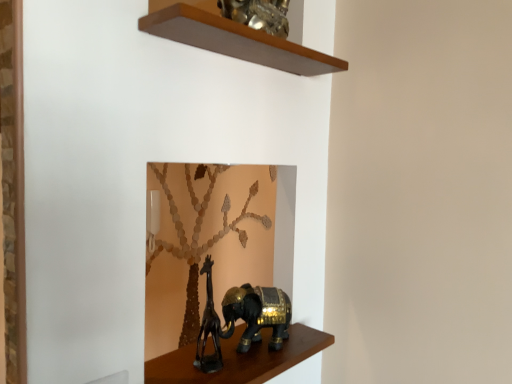
Question: Can you confirm if black matte giraffe at lower center is thinner than shiny black elephant at lower center, the 2th shelf when ordered from top to bottom?

Choices:
 (A) no
 (B) yes

Answer: (B)

Question: From a real-world perspective, is black matte giraffe at lower center below shiny black elephant at lower center, which is the 1th shelf in bottom-to-top order?

Choices:
 (A) no
 (B) yes

Answer: (A)

Question: Would you consider black matte giraffe at lower center to be distant from shiny black elephant at lower center, the 2th shelf when ordered from top to bottom?

Choices:
 (A) no
 (B) yes

Answer: (A)

Question: Is black matte giraffe at lower center at the left side of shiny black elephant at lower center, the 2th shelf when ordered from top to bottom?

Choices:
 (A) no
 (B) yes

Answer: (B)

Question: Considering the relative sizes of black matte giraffe at lower center and shiny black elephant at lower center, which is the 1th shelf in bottom-to-top order, in the image provided, is black matte giraffe at lower center taller than shiny black elephant at lower center, which is the 1th shelf in bottom-to-top order,?

Choices:
 (A) yes
 (B) no

Answer: (A)

Question: From the image's perspective, is black matte giraffe at lower center located above shiny black elephant at lower center, which is the 1th shelf in bottom-to-top order?

Choices:
 (A) yes
 (B) no

Answer: (A)

Question: Is black matte giraffe at lower center completely or partially inside shiny black elephant at lower center, which is the 1th shelf in bottom-to-top order?

Choices:
 (A) yes
 (B) no

Answer: (B)

Question: From the image's perspective, does shiny black elephant at lower center, which is the 1th shelf in bottom-to-top order, appear lower than black matte giraffe at lower center?

Choices:
 (A) no
 (B) yes

Answer: (B)

Question: Considering the relative sizes of shiny black elephant at lower center, which is the 1th shelf in bottom-to-top order, and black matte giraffe at lower center in the image provided, is shiny black elephant at lower center, which is the 1th shelf in bottom-to-top order, shorter than black matte giraffe at lower center?

Choices:
 (A) no
 (B) yes

Answer: (B)

Question: Is shiny black elephant at lower center, which is the 1th shelf in bottom-to-top order, oriented away from black matte giraffe at lower center?

Choices:
 (A) yes
 (B) no

Answer: (B)

Question: Can you confirm if shiny black elephant at lower center, the 2th shelf when ordered from top to bottom, is bigger than black matte giraffe at lower center?

Choices:
 (A) no
 (B) yes

Answer: (B)

Question: Could you tell me if shiny black elephant at lower center, the 2th shelf when ordered from top to bottom, is turned towards black matte giraffe at lower center?

Choices:
 (A) no
 (B) yes

Answer: (A)

Question: From a real-world perspective, is wooden shelf at upper center, which is counted as the 2th shelf, starting from the bottom, located higher than shiny black elephant at lower center, which is the 1th shelf in bottom-to-top order?

Choices:
 (A) no
 (B) yes

Answer: (B)